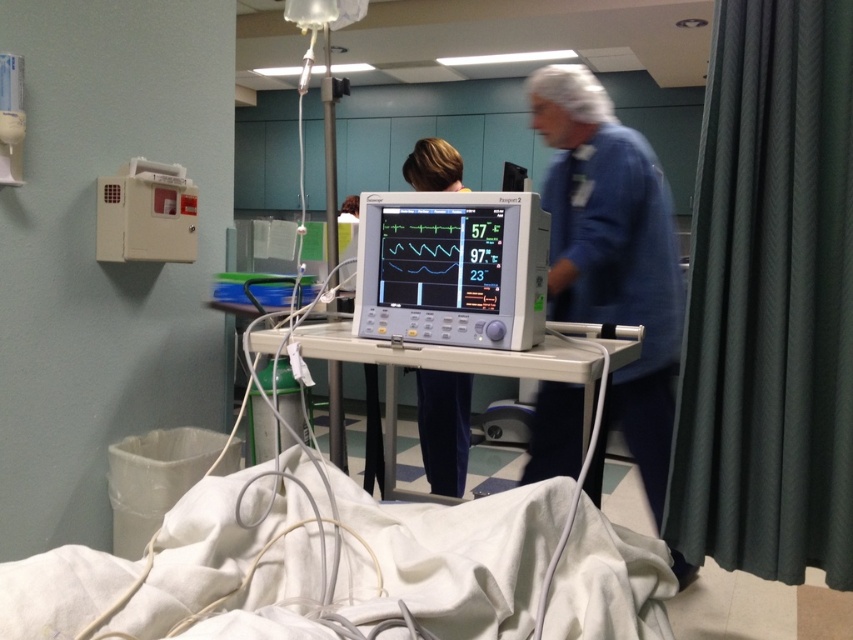
You are a patient in this hospital room and want to reach the nurse who is walking away. You see two points marked in the room. The first point is at coordinates point (718, 253) and the second point is at coordinates point (619, 556). Which point should you move towards to intercept the nurse?

You should move towards point (619, 556) because point (718, 253) is behind point (619, 556), meaning the nurse is moving away from that direction and closer to point (619, 556).

You are a patient in the hospital room and want to see the white plastic monitor at center. However, the green textured curtain at right is blocking your view. Can you move the curtain to get a clear view of the monitor?

The green textured curtain at right is positioned under the white plastic monitor at center, so moving the curtain would allow you to see the monitor clearly since it is below it and not in front.